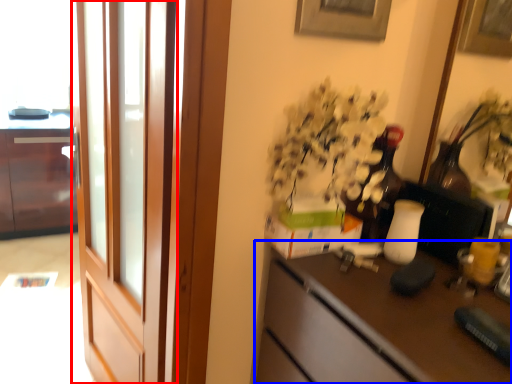
Question: Among these objects, which one is farthest to the camera, screen door (highlighted by a red box) or desk (highlighted by a blue box)?

Choices:
 (A) screen door
 (B) desk

Answer: (A)